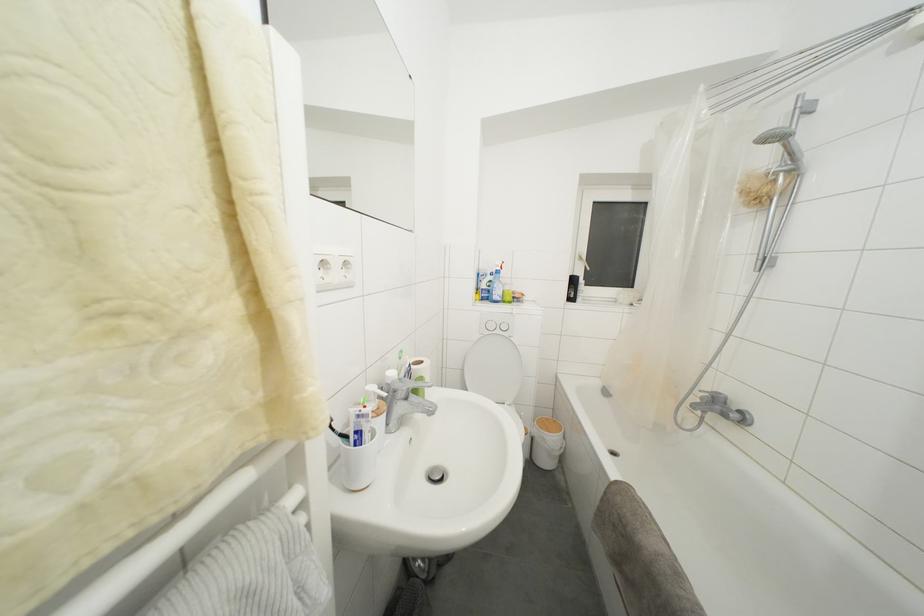
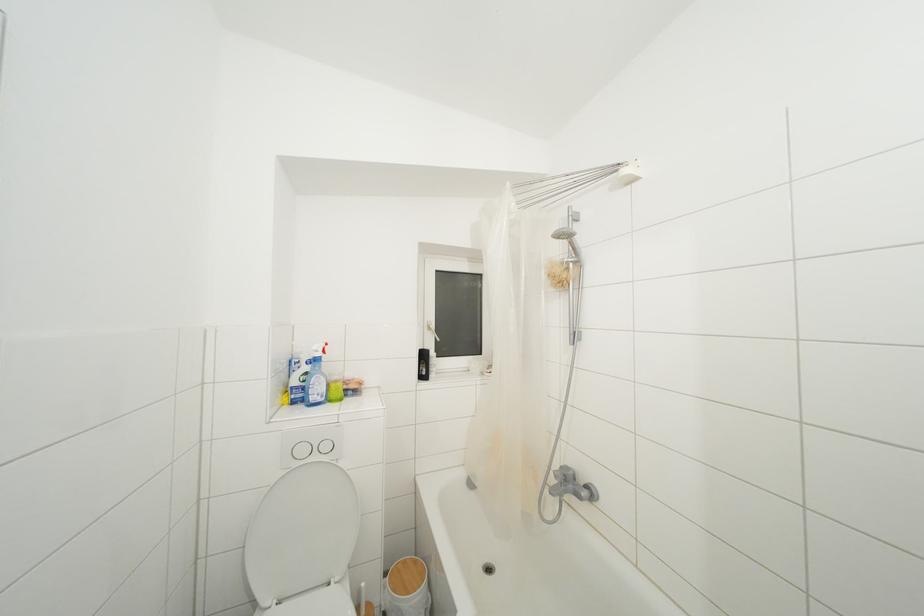
Find the pixel in the second image that matches point 552,424 in the first image.

(408, 567)